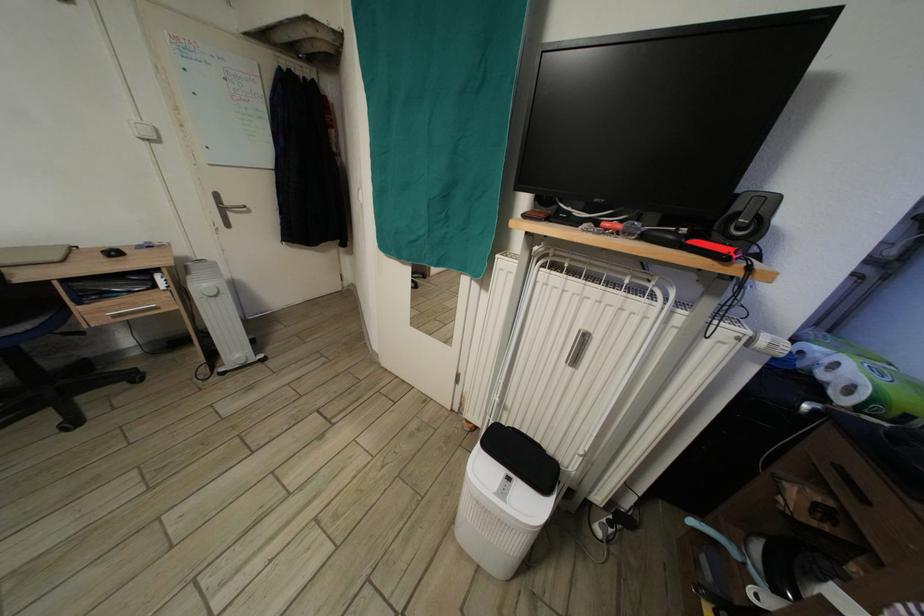
The image size is (924, 616). I want to click on speaker control knob, so click(757, 228).